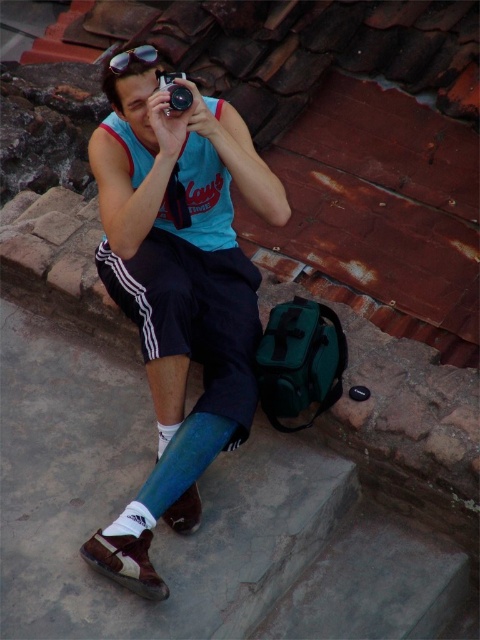
Question: Estimate the real-world distances between objects in this image. Which object is farther from the blue fabric shorts at center?

Choices:
 (A) shiny plastic goggles at upper center
 (B) black plastic camera at center

Answer: (A)

Question: Is blue fabric shorts at center in front of black plastic camera at center?

Choices:
 (A) no
 (B) yes

Answer: (B)

Question: Which point is farther to the camera?

Choices:
 (A) (163, 362)
 (B) (120, 58)

Answer: (B)

Question: Where is black plastic camera at center located in relation to shiny plastic goggles at upper center in the image?

Choices:
 (A) right
 (B) left

Answer: (A)

Question: Does blue fabric shorts at center have a lesser width compared to black plastic camera at center?

Choices:
 (A) yes
 (B) no

Answer: (B)

Question: Which point is farther to the camera?

Choices:
 (A) shiny plastic goggles at upper center
 (B) blue fabric shorts at center
 (C) black plastic camera at center

Answer: (A)